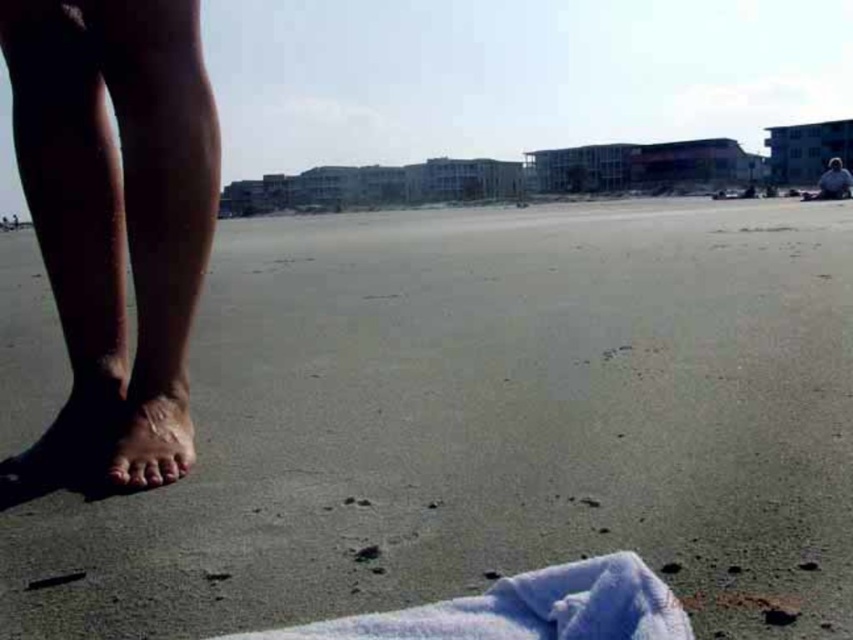
Looking at this image, you are a photographer trying to capture a closeup of the smooth skin foot at lower left and the dark blue fabric at upper right in the beach scene. Which object should you focus on first to ensure it appears sharp in your photo?

The smooth skin foot at lower left is closer to the viewer than the dark blue fabric at upper right, so you should focus on the smooth skin foot at lower left first to ensure it appears sharp.

You are at the beach and want to spread out a towel. You have a soft blue towel at lower center and a dark blue fabric at upper right. Which one is more suitable for covering a larger area?

The dark blue fabric at upper right is more suitable for covering a larger area because it has a bigger size than the soft blue towel at lower center.

You are a photographer trying to capture the texture of the dry skin at lower left and the dry skin foot at lower left. Since you want to focus on the foot, which object should you move your camera closer to?

You should move your camera closer to the dry skin foot at lower left because it is located below the dry skin at lower left, making it closer to the camera when viewed from a low angle.